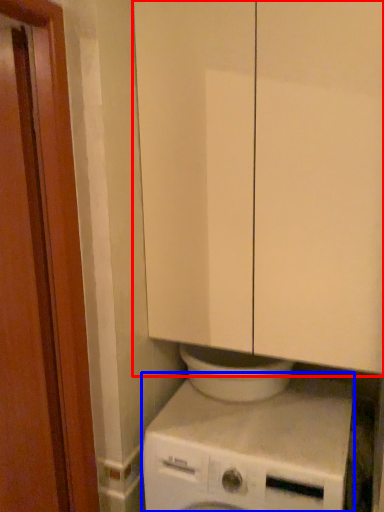
Question: Which point is closer to the camera, cabinetry (highlighted by a red box) or washing machine (highlighted by a blue box)?

Choices:
 (A) cabinetry
 (B) washing machine

Answer: (A)